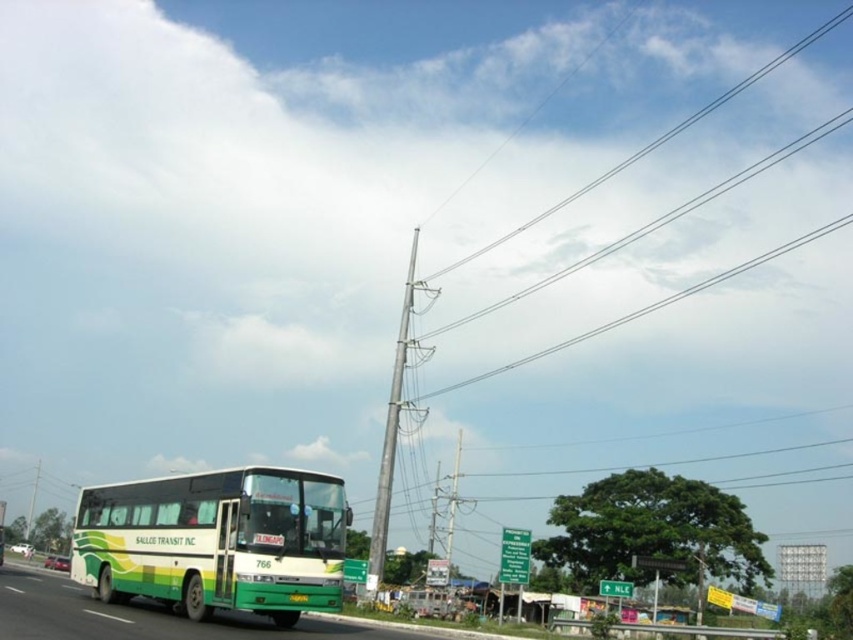
You are a pedestrian standing at the roadside near the silver metallic pole at upper center. You want to cross the road to reach the shops on the right. The green matte bus at center is moving towards you. Should you wait for the bus to pass before crossing?

The green matte bus at center is positioned on the left side of the silver metallic pole at upper center, meaning it is approaching from the left. Since the bus is moving towards you, you should wait for it to pass before attempting to cross the road safely.

You are standing at the camera position observing the road scene. There is a point marked at coordinates point (x=241, y=579). If you want to place a safety cone exactly at that point, how far in meters should you walk from your current position to reach it?

The distance of point (x=241, y=579) from camera is 20.18 meters, so you should walk 20.18 meters from your current position to reach it.